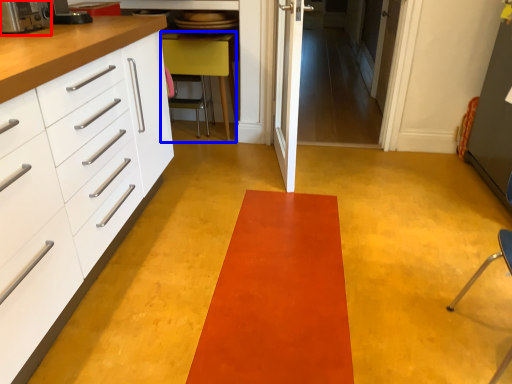
Question: Which object is further to the camera taking this photo, appliance (highlighted by a red box) or furniture (highlighted by a blue box)?

Choices:
 (A) appliance
 (B) furniture

Answer: (B)